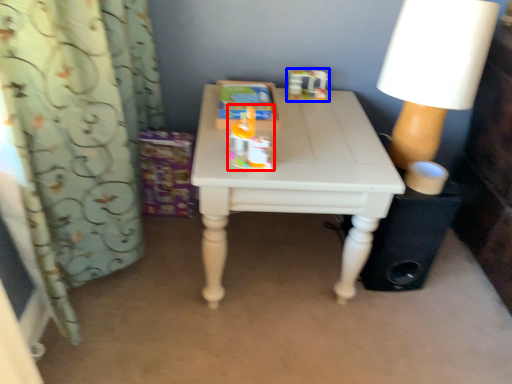
Question: Which point is further to the camera, toy (highlighted by a red box) or toy (highlighted by a blue box)?

Choices:
 (A) toy
 (B) toy

Answer: (B)